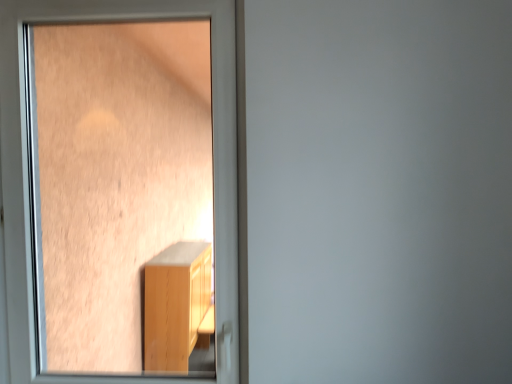
The height and width of the screenshot is (384, 512). What do you see at coordinates (28, 176) in the screenshot? I see `transparent glass window at upper left` at bounding box center [28, 176].

At what (x,y) coordinates should I click in order to perform the action: click on transparent glass window at upper left. Please return your answer as a coordinate pair (x, y). This screenshot has height=384, width=512. Looking at the image, I should click on (28, 176).

The height and width of the screenshot is (384, 512). Find the location of `transparent glass window at upper left`. transparent glass window at upper left is located at coordinates (28, 176).